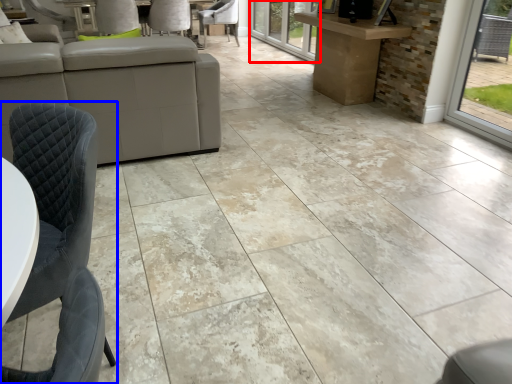
Question: Among these objects, which one is nearest to the camera, glass door (highlighted by a red box) or chair (highlighted by a blue box)?

Choices:
 (A) glass door
 (B) chair

Answer: (B)